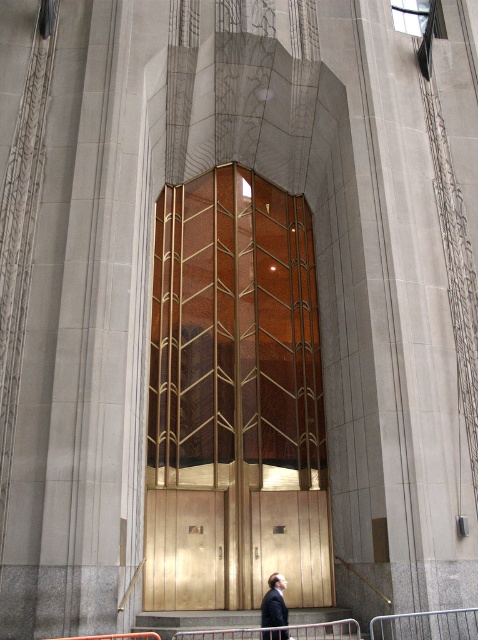
You are standing in front of the grand Art Deco building and see the gold metallic stair at center and the dark suit at center. Which object is located above the other?

The dark suit at center is above the gold metallic stair at center because the gold metallic stair at center is positioned under it.

You are standing in front of the grand building and want to enter. You see the gold textured elevator at center and the gold metallic stair at center. Which one is closer to you?

The gold textured elevator at center is closer to you because the gold metallic stair at center is behind it.

You are an architect evaluating the grand building. You need to determine which of the two gold elements, the gold textured elevator at center or the gold metallic stair at center, requires more space for maintenance access. Based on their sizes, which one would need a larger maintenance area?

The gold textured elevator at center is larger in size than the gold metallic stair at center, so it would require a larger maintenance area.